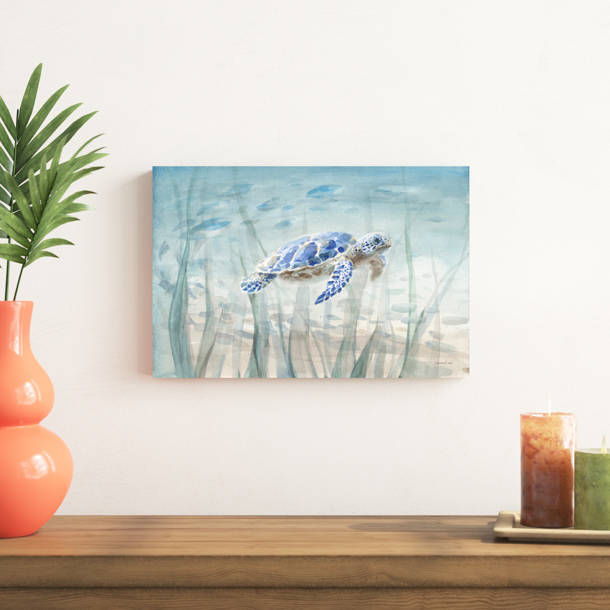
The width and height of the screenshot is (610, 610). I want to click on wall below painting, so click(263, 434).